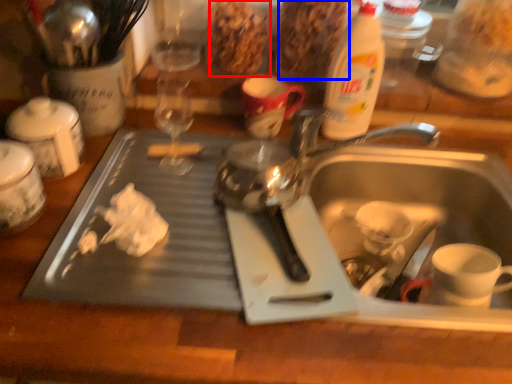
Question: Which of the following is the farthest to the observer, food (highlighted by a red box) or food (highlighted by a blue box)?

Choices:
 (A) food
 (B) food

Answer: (A)